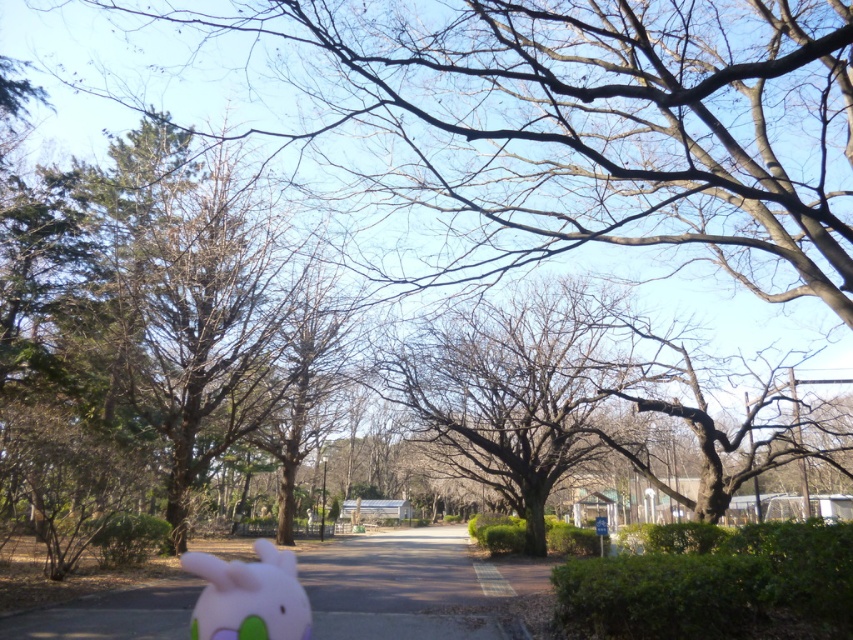
You are a park visitor who wants to walk from the start of the pathway to the end. The pathway is bordered by green hedges on both sides. There are also bare branches at center. How far apart are the green hedges on the left and right sides of the pathway?

The green hedges on the left and right sides of the pathway are 9.22 meters apart.

You are a child looking for a lost toy in the park. You see the bare branches at center and the pink felt plushie at lower left. Which object is closer to you?

The pink felt plushie at lower left is behind the bare branches at center, so the bare branches at center are closer to you.